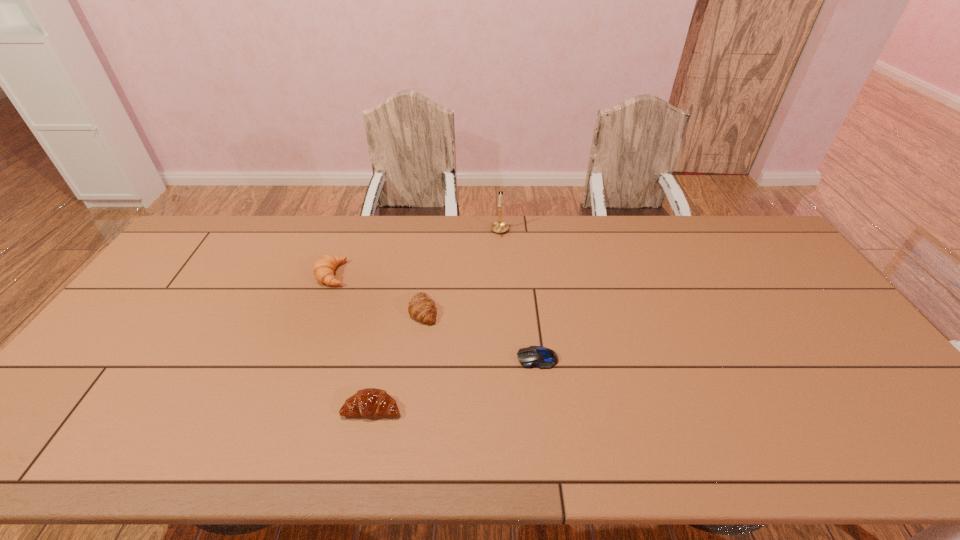
At what (x,y) coordinates should I click in order to perform the action: click on vacant space located on the front of the second farthest crescent roll. Please return your answer as a coordinate pair (x, y). Looking at the image, I should click on (419, 340).

The width and height of the screenshot is (960, 540). Identify the location of blank area located on the front of the nearest object. (362, 458).

Where is `free space located on the button side of the computer mouse`? The height and width of the screenshot is (540, 960). free space located on the button side of the computer mouse is located at coordinates (445, 358).

Find the location of a particular element. This screenshot has width=960, height=540. free space located on the button side of the computer mouse is located at coordinates (464, 358).

Locate an element on the screen. The width and height of the screenshot is (960, 540). vacant space located on the button side of the computer mouse is located at coordinates (438, 358).

Where is `object positioned at the far edge`? The width and height of the screenshot is (960, 540). object positioned at the far edge is located at coordinates (499, 227).

Find the location of a particular element. free space at the far edge of the desktop is located at coordinates (702, 254).

The height and width of the screenshot is (540, 960). In the image, there is a desktop. Find the location of `free space at the near edge`. free space at the near edge is located at coordinates (780, 441).

The image size is (960, 540). In the image, there is a desktop. What are the coordinates of `vacant space at the left edge` in the screenshot? It's located at (104, 384).

You are a GUI agent. You are given a task and a screenshot of the screen. Output one action in this format:
    pyautogui.click(x=<x>, y=<y>)
    Task: Click on the vacant space at the right edge
    
    Given the screenshot: What is the action you would take?
    [794, 327]